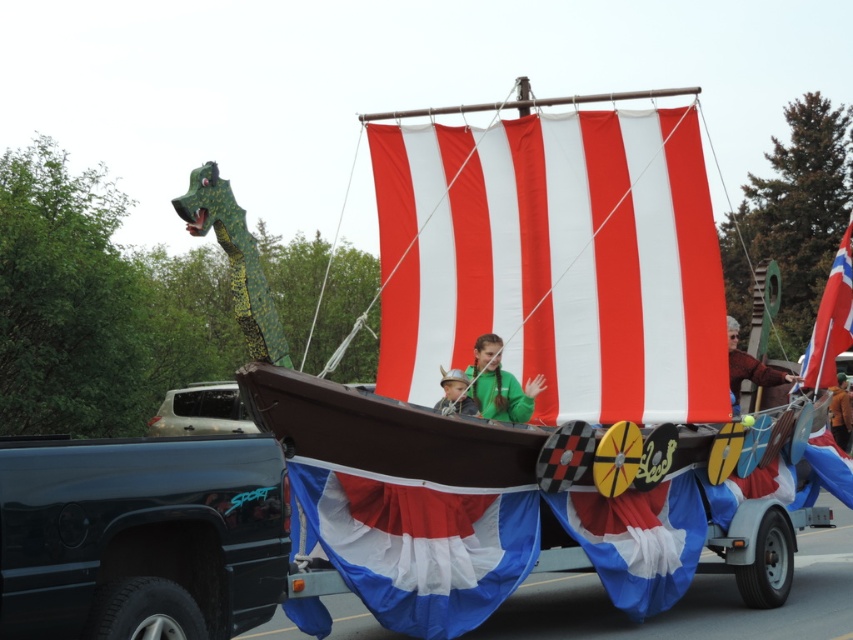
Who is positioned more to the right, black glossy truck at lower left or orange fabric at center?

From the viewer's perspective, orange fabric at center appears more on the right side.

Is point (273, 472) more distant than point (838, 396)?

No, it is not.

Identify the location of black glossy truck at lower left. The height and width of the screenshot is (640, 853). (141, 536).

Find the location of a particular element. black glossy truck at lower left is located at coordinates (141, 536).

Does red/white striped sail at center have a lesser width compared to blue and white fabric flag at lower center?

No.

Can you confirm if red/white striped sail at center is smaller than blue and white fabric flag at lower center?

No.

Who is more distant from viewer, (425,173) or (422,612)?

Positioned behind is point (425,173).

This screenshot has width=853, height=640. I want to click on red/white striped sail at center, so click(x=555, y=260).

Does blue fabric sail at center have a greater width compared to brown leather jacket at upper right?

Yes.

Image resolution: width=853 pixels, height=640 pixels. Describe the element at coordinates (637, 540) in the screenshot. I see `blue fabric sail at center` at that location.

Who is more distant from viewer, (618,532) or (735,355)?

The point (735,355) is behind.

Find the location of a particular element. blue fabric sail at center is located at coordinates (637, 540).